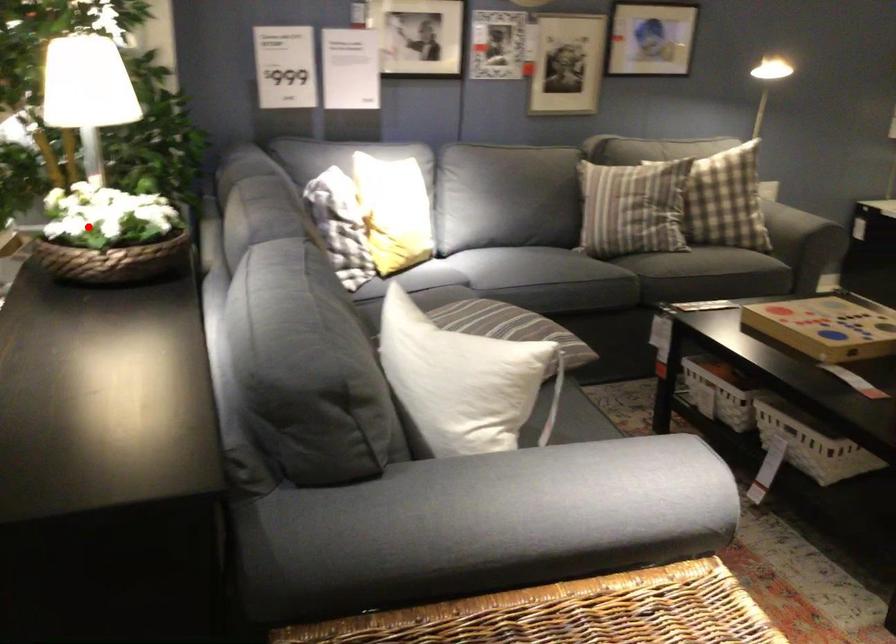
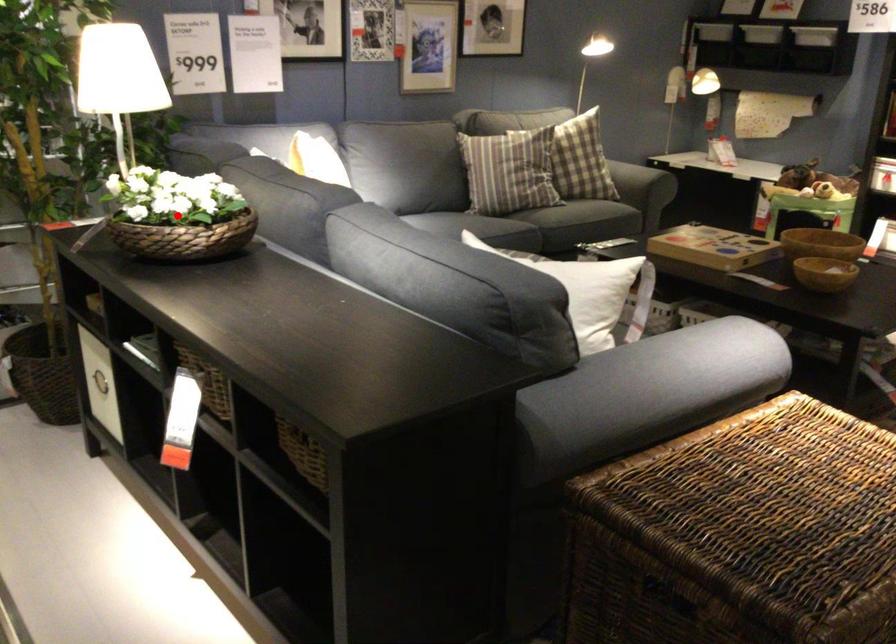
I am providing you with two images of the same scene from different viewpoints. A red point is marked on the first image and another point is marked on the second image. Is the marked point in image1 the same physical position as the marked point in image2?

Yes